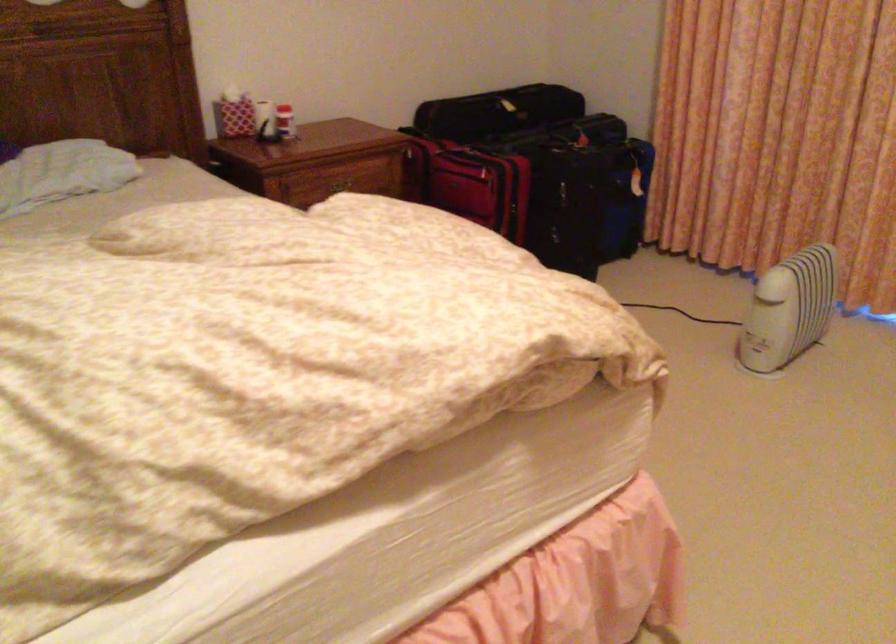
Find where to pull the wooden drawer handle. Please return your answer as a coordinate pair (x, y).

(338, 185)